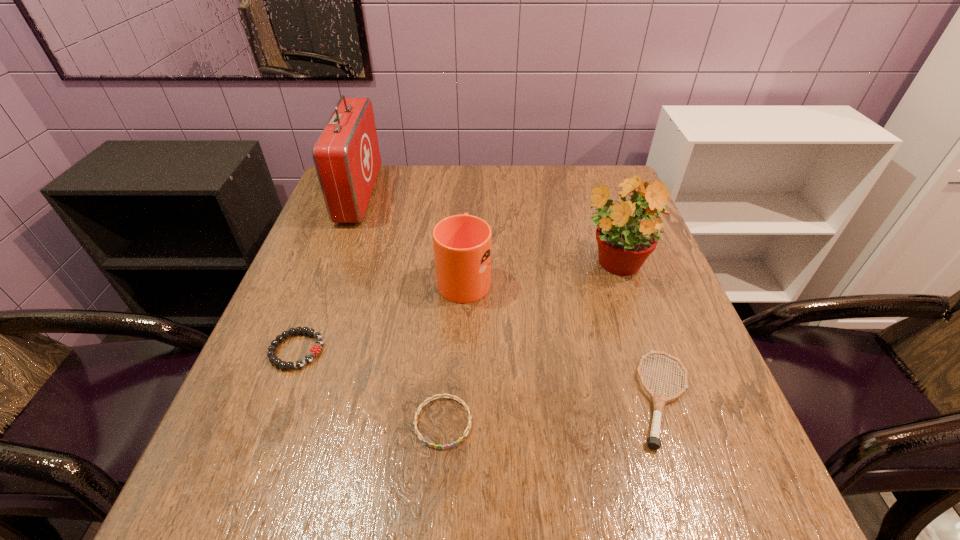
What are the coordinates of `free space located on the handle side of the third tallest object` in the screenshot? It's located at (467, 214).

At what (x,y) coordinates should I click in order to perform the action: click on vacant region located 0.130m on the handle side of the third tallest object. Please return your answer as a coordinate pair (x, y). Looking at the image, I should click on (467, 221).

This screenshot has width=960, height=540. Identify the location of vacant space located 0.370m on the handle side of the third tallest object. (468, 176).

Where is `free spot located on the left of the tennis racket`? free spot located on the left of the tennis racket is located at coordinates (455, 399).

The width and height of the screenshot is (960, 540). Identify the location of free location located on the back of the farther bracelet. (341, 234).

I want to click on blank space located on the surface of the shortest object showing star-shaped elements, so click(x=439, y=481).

Identify the location of object located at the far edge. (346, 155).

The width and height of the screenshot is (960, 540). In order to click on the first-aid kit that is at the left edge in this screenshot , I will do pyautogui.click(x=346, y=155).

Identify the location of bracelet present at the left edge. The image size is (960, 540). (315, 350).

Locate an element on the screen. flowerpot located in the right edge section of the desktop is located at coordinates (624, 243).